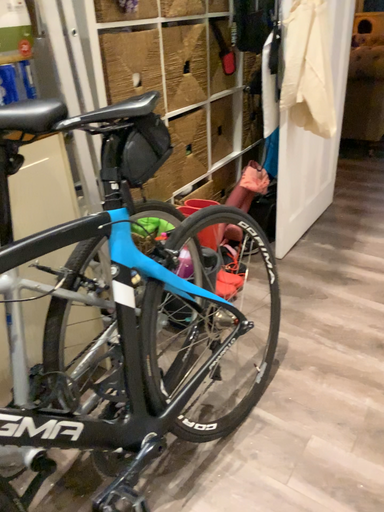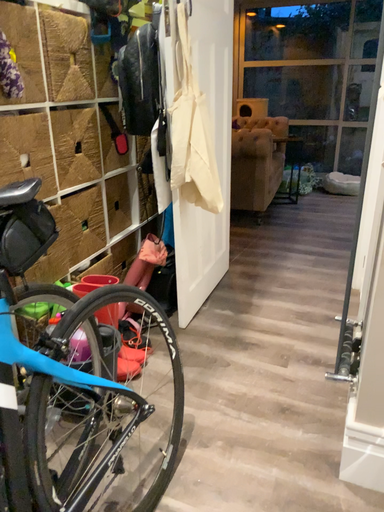
Question: Which way did the camera rotate in the video?

Choices:
 (A) rotated upward
 (B) rotated downward

Answer: (A)